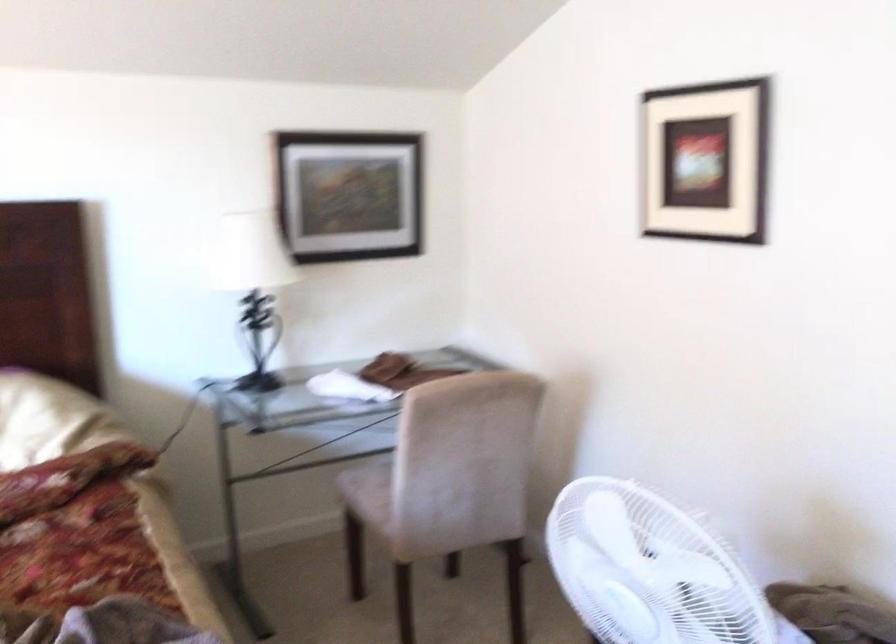
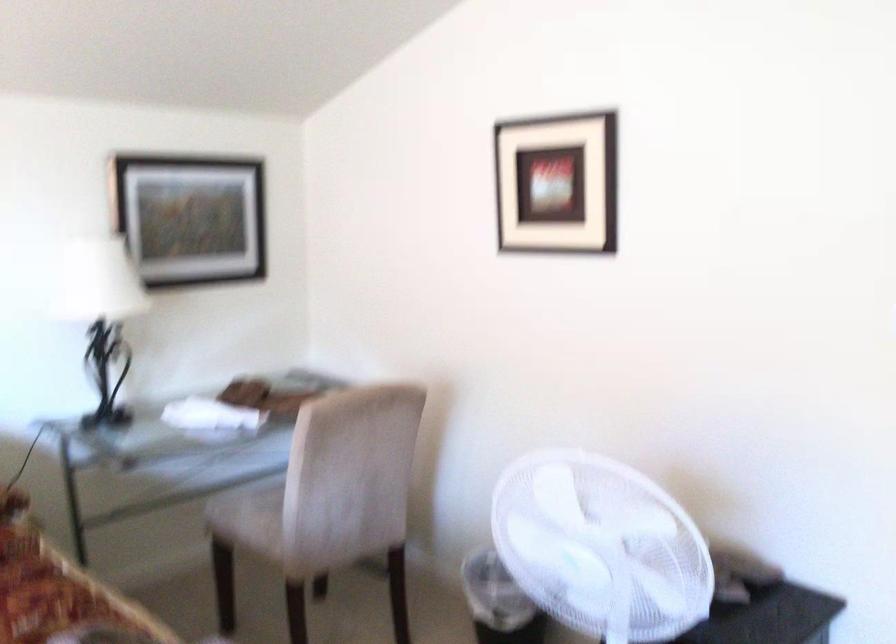
Question: The first image is from the beginning of the video and the second image is from the end. How did the camera likely rotate when shooting the video?

Choices:
 (A) Left
 (B) Right
 (C) Up
 (D) Down

Answer: (B)